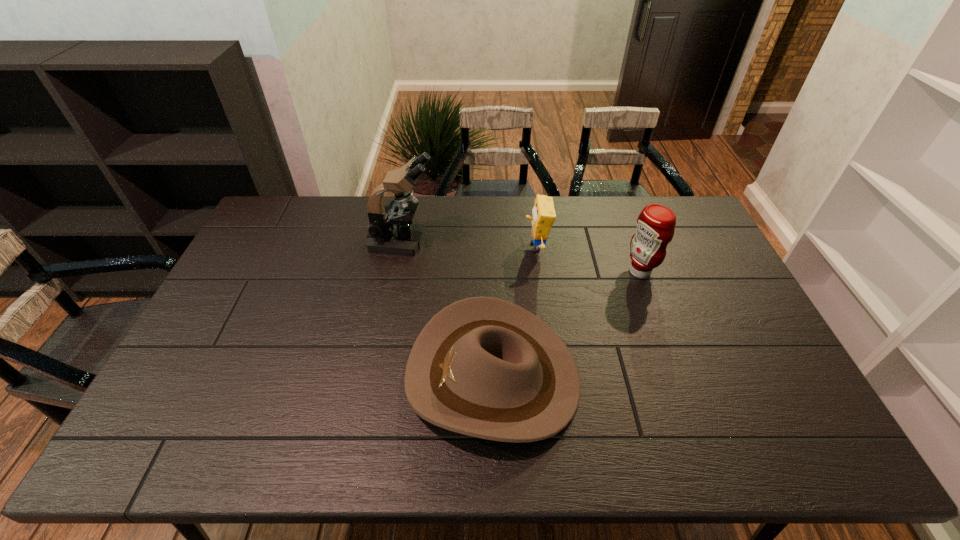
Find the location of `free space at the far left corner of the desktop`. free space at the far left corner of the desktop is located at coordinates (272, 215).

Where is `vacant space that is in between the rightmost object and the sponge`? This screenshot has height=540, width=960. vacant space that is in between the rightmost object and the sponge is located at coordinates click(588, 259).

Find the location of `vacant region between the third shortest object and the tallest object`. vacant region between the third shortest object and the tallest object is located at coordinates (521, 256).

I want to click on free space between the sponge and the tallest object, so click(469, 244).

I want to click on empty space between the third shortest object and the cowboy hat, so click(x=566, y=324).

Find the location of a particular element. Image resolution: width=960 pixels, height=540 pixels. empty space between the third shortest object and the microscope is located at coordinates (521, 256).

This screenshot has width=960, height=540. Identify the location of free spot between the second tallest object and the tallest object. (521, 256).

This screenshot has width=960, height=540. I want to click on free space that is in between the microscope and the sponge, so click(x=469, y=244).

Identify the location of object identified as the third closest to the tallest object. (656, 223).

Point out which object is positioned as the second nearest to the nearest object. Please provide its 2D coordinates. Your answer should be formatted as a tuple, i.e. [(x, y)], where the tuple contains the x and y coordinates of a point satisfying the conditions above.

[(656, 223)]